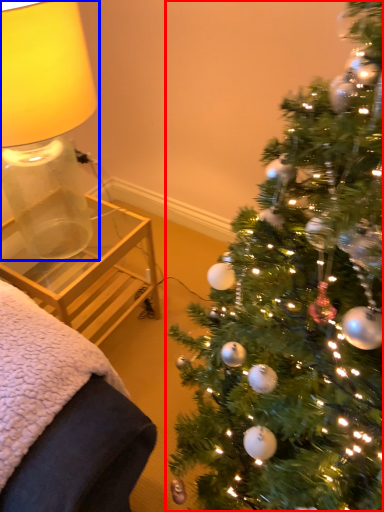
Question: Which point is further to the camera, christmas tree (highlighted by a red box) or table lamp (highlighted by a blue box)?

Choices:
 (A) christmas tree
 (B) table lamp

Answer: (B)